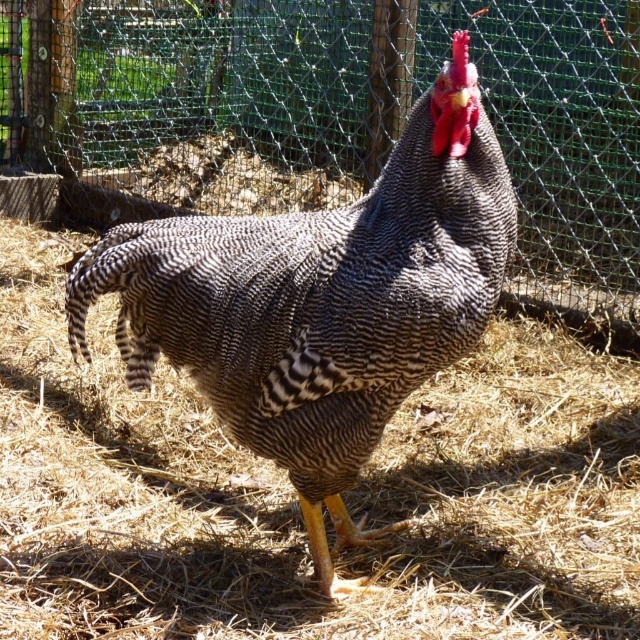
In the scene shown: You are a farmer checking on your animals. You notice a green mesh fence at center and a speckled feathered rooster at center in your enclosure. Which object is closer to you as you stand at the entrance?

The speckled feathered rooster at center is closer to you than the green mesh fence at center because the green mesh fence at center is further away.

You are standing in a chicken coop and see a point marked at coordinates (x=340, y=115). According to the scene description, what object is located at that point?

The point at coordinates (x=340, y=115) corresponds to the green mesh fence at center.

Based on the photo, you are a farmer checking the chicken coop. You notice two points marked in the image. One is at point (486, 76) and the other at point (228, 284). From your vantage point, which point is closer to you?

Point (228, 284) is closer to you because point (486, 76) is behind it.